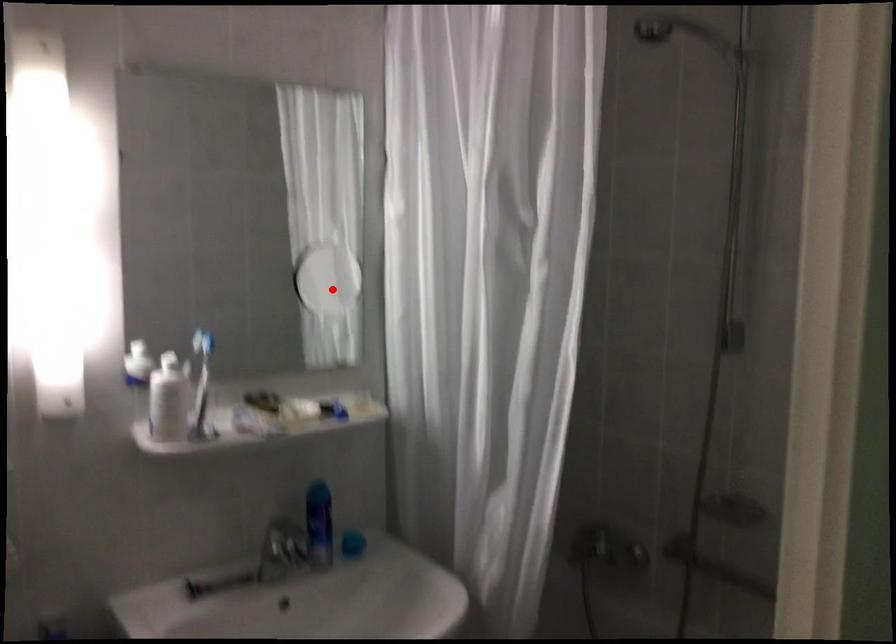
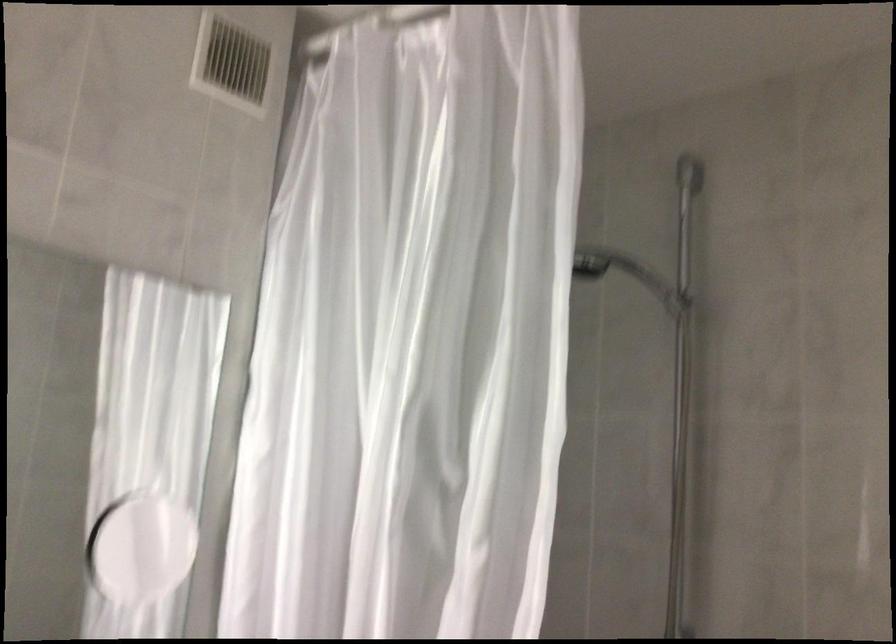
Question: I am providing you with two images of the same scene from different viewpoints. Image1 has a red point marked. In image2, the corresponding 3D location appears at what relative position? Reply with the corresponding letter.

Choices:
 (A) Closer
 (B) Farther

Answer: (A)